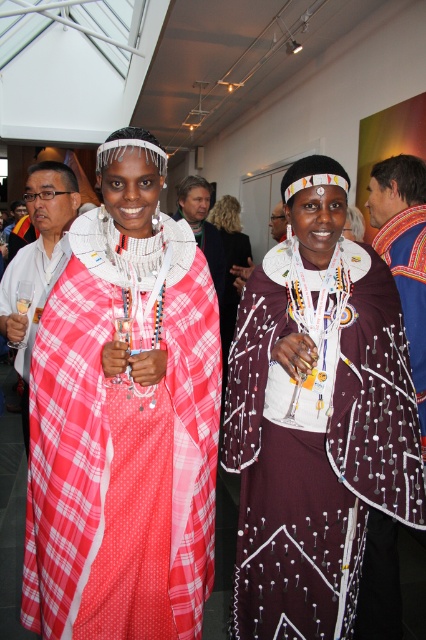
You are a photographer trying to capture a closeup of the pink plaid shawl at center. Based on its position coordinates, can you determine if it is located in the upper half or lower half of the image?

The pink plaid shawl at center is located at point coordinates of (123, 433). Since the y coordinate is 0.289, which is less than 0.5, it is in the lower half of the image.

You are trying to locate the point with coordinates (37, 259) in the image. Based on the scene description, which object does this point lie on?

The point with coordinates (37, 259) is located on the matte plaid shawl at left.

You are a photographer setting up a tripod to take a group photo of the matte plaid shawl at left and the matte white shirt at center. The tripod requires a minimum distance of 1.5 meters between the two subjects to focus properly. Can the tripod focus on both subjects at the same time?

The distance between the matte plaid shawl at left and the matte white shirt at center is 1.66 meters, which is greater than the required 1.5 meters. Therefore, the tripod can focus on both subjects simultaneously.